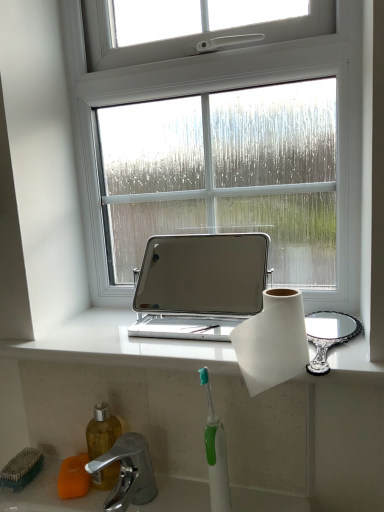
Question: Is white paper at center wider or thinner than silver metallic laptop at center?

Choices:
 (A) wide
 (B) thin

Answer: (B)

Question: Is white paper at center bigger or smaller than silver metallic laptop at center?

Choices:
 (A) big
 (B) small

Answer: (B)

Question: Which is nearer to the white paper at center?

Choices:
 (A) green plastic toothbrush at lower center
 (B) chrome metallic faucet at lower left
 (C) orange sponge at lower left
 (D) silver metallic laptop at center
 (E) white marble window sill at center

Answer: (A)

Question: Which of these objects is positioned farthest from the white marble window sill at center?

Choices:
 (A) white paper at center
 (B) green bristle brush at lower left
 (C) green plastic toothbrush at lower center
 (D) chrome metallic faucet at lower left
 (E) orange sponge at lower left

Answer: (B)